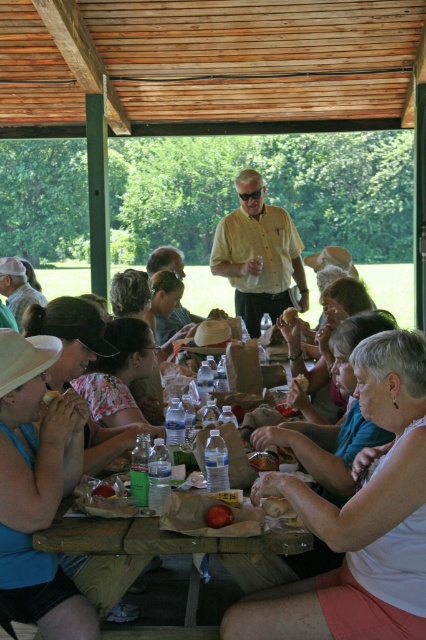
You are a photographer trying to capture a closeup of the brown crumbly bread at center without including the matte blue shirt at lower left in the frame. Given their sizes, is this feasible?

The matte blue shirt at lower left is wider than the brown crumbly bread at center, so it might be challenging to frame the bread without including the shirt if they are positioned close together. Adjusting the camera angle or moving closer to the bread could help isolate it.

You are organizing a picnic and need to place two items on the table. You have a smooth brown bread at lower center and a smooth brown bread at lower left. Which one has a larger width?

The smooth brown bread at lower center might be wider than smooth brown bread at lower left, so it could have a larger width.